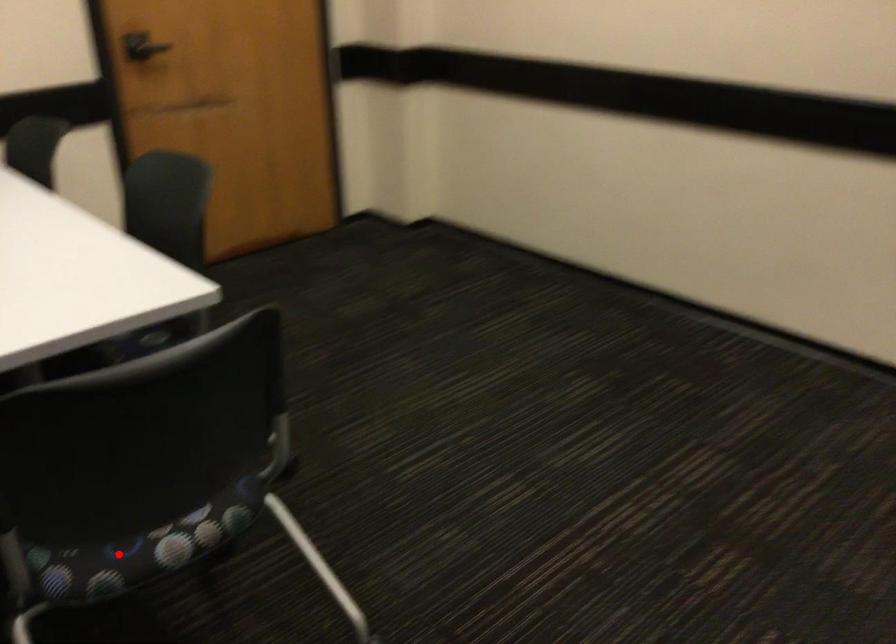
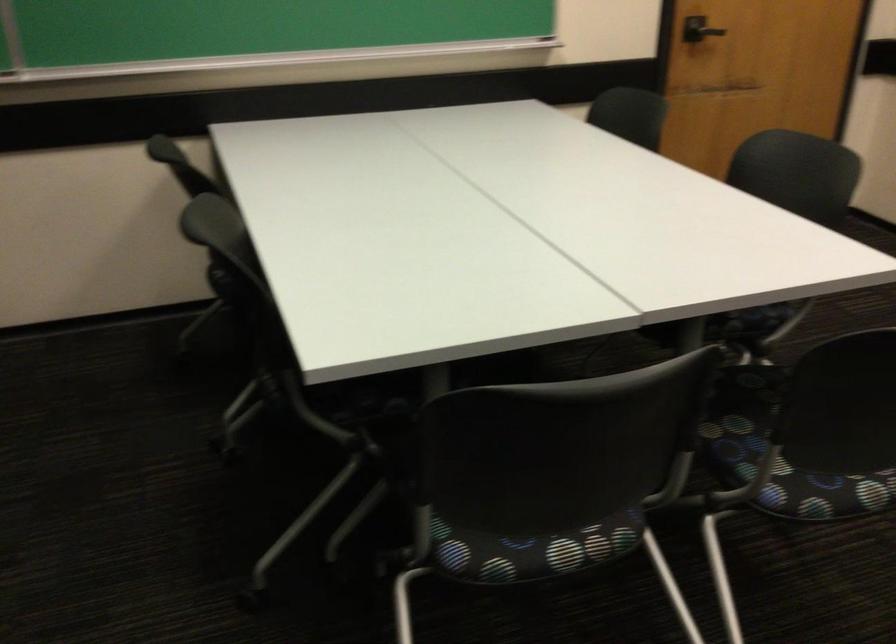
In the second image, find the point that corresponds to the highlighted location in the first image.

(823, 493)